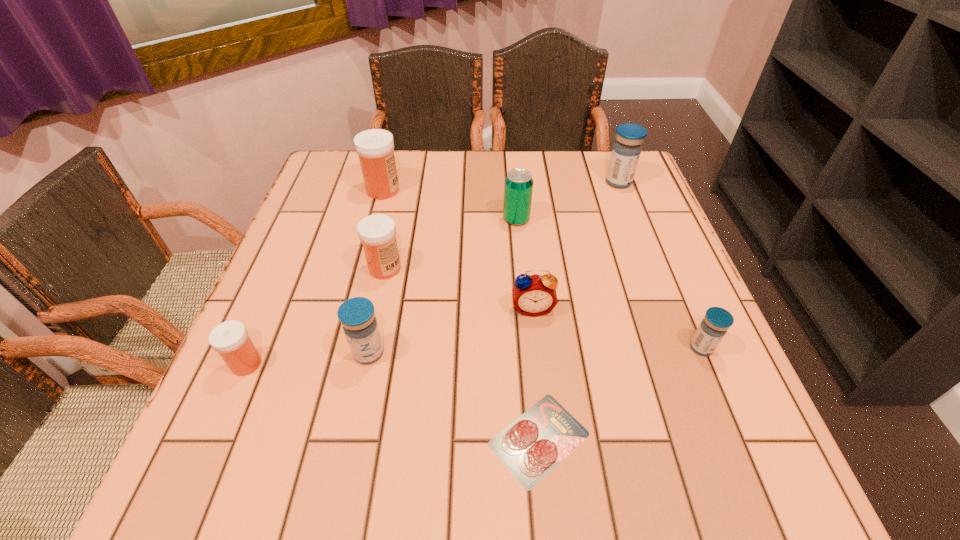
The width and height of the screenshot is (960, 540). Find the location of `vacant region located 0.300m on the back of the smallest blue medicine`. vacant region located 0.300m on the back of the smallest blue medicine is located at coordinates (654, 234).

Find the location of `vacant region located 0.260m on the right of the leftmost medicine`. vacant region located 0.260m on the right of the leftmost medicine is located at coordinates (408, 364).

Find the location of a particular element. vacant space situated 0.200m on the left of the shortest object is located at coordinates (361, 439).

Where is `object located in the near edge section of the desktop`? This screenshot has height=540, width=960. object located in the near edge section of the desktop is located at coordinates (535, 443).

The image size is (960, 540). I want to click on object present at the far left corner, so click(375, 147).

Where is `object that is at the far right corner`? The height and width of the screenshot is (540, 960). object that is at the far right corner is located at coordinates (626, 151).

Locate an element on the screen. The height and width of the screenshot is (540, 960). vacant space at the far edge of the desktop is located at coordinates (468, 152).

Identify the location of free region at the near edge of the desktop. (466, 475).

Identify the location of vacant space at the left edge of the desktop. (330, 281).

The image size is (960, 540). In order to click on vacant space at the right edge of the desktop in this screenshot , I will do `click(693, 359)`.